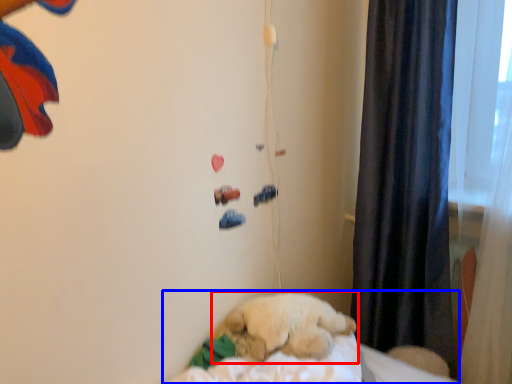
Question: Among these objects, which one is nearest to the camera, dog (highlighted by a red box) or bed (highlighted by a blue box)?

Choices:
 (A) dog
 (B) bed

Answer: (B)